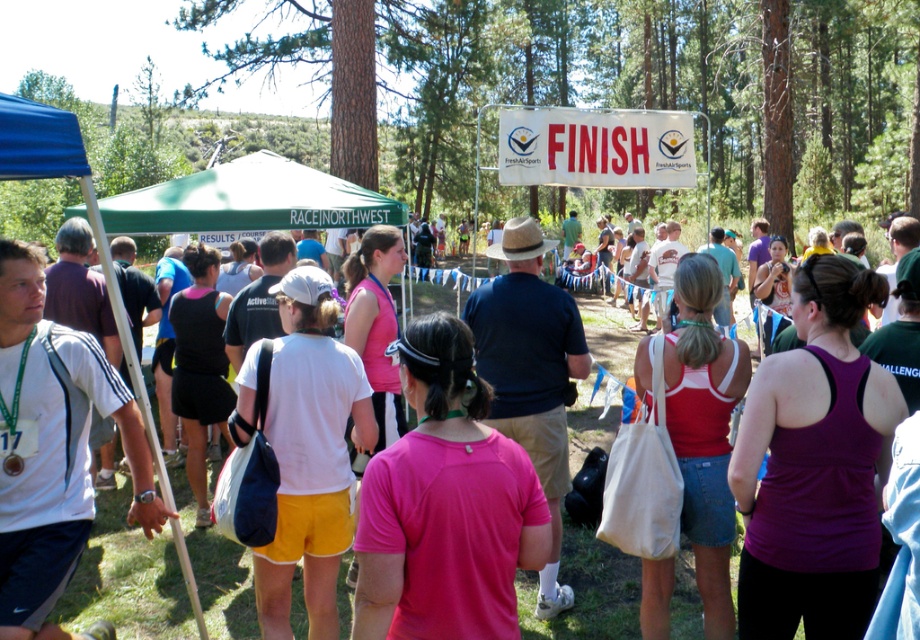
Based on the photo, which is above, pink fabric shirt at center or white fabric bag at center?

pink fabric shirt at center

Is pink fabric shirt at center to the left of white fabric bag at center from the viewer's perspective?

In fact, pink fabric shirt at center is to the right of white fabric bag at center.

Locate an element on the screen. The width and height of the screenshot is (920, 640). pink fabric shirt at center is located at coordinates (445, 506).

Where is `pink fabric shirt at center`? pink fabric shirt at center is located at coordinates click(x=445, y=506).

Is point (456, 600) in front of point (335, 204)?

Yes.

Is the position of pink fabric shirt at center more distant than that of green fabric canopy at center?

No, it is in front of green fabric canopy at center.

At what (x,y) coordinates should I click in order to perform the action: click on pink fabric shirt at center. Please return your answer as a coordinate pair (x, y). Image resolution: width=920 pixels, height=640 pixels. Looking at the image, I should click on (445, 506).

This screenshot has height=640, width=920. I want to click on white fabric bag at center, so click(x=309, y=454).

Who is positioned more to the right, white fabric bag at center or green fabric canopy at center?

Positioned to the right is white fabric bag at center.

Is point (326, 314) closer to camera compared to point (256, 180)?

Yes, it is.

Where is `white fabric bag at center`? The height and width of the screenshot is (640, 920). white fabric bag at center is located at coordinates (309, 454).